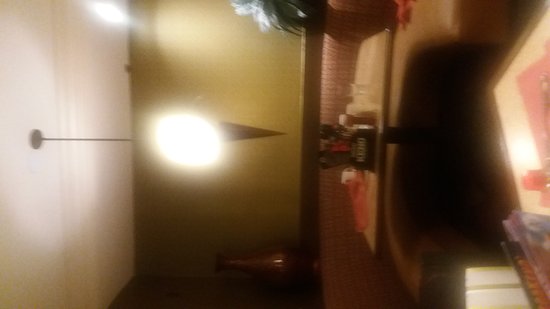
The height and width of the screenshot is (309, 550). What are the coordinates of `ceiling` in the screenshot? It's located at (62, 92).